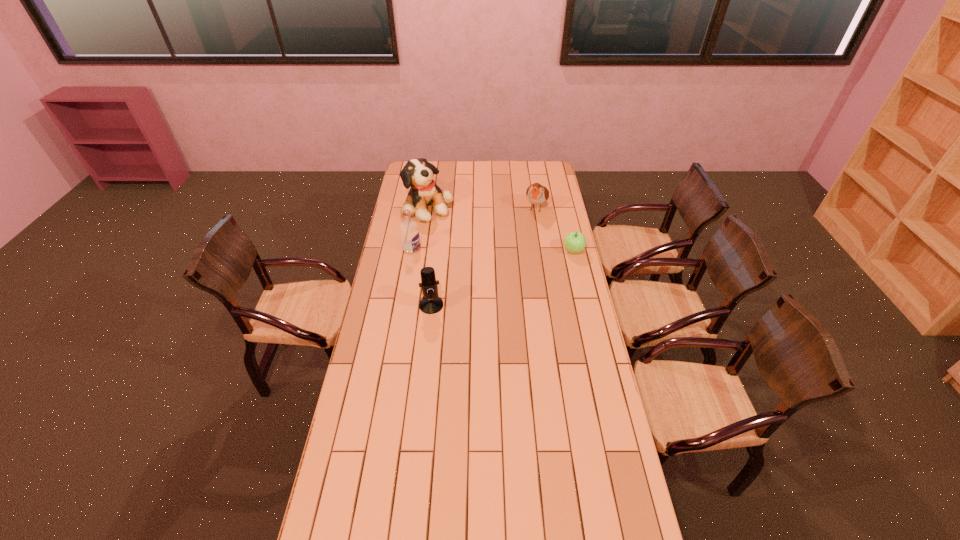
Find the location of a particular element. This screenshot has height=540, width=960. vacant space on the desktop that is between the microphone and the rightmost object and is positioned at the face of the fourth object from left to right is located at coordinates (506, 276).

You are a GUI agent. You are given a task and a screenshot of the screen. Output one action in this format:
    pyautogui.click(x=<x>, y=<y>)
    Task: Click on the free space on the desktop that is between the nearest object and the shortest object and is positioned on the label of the vodka
    The height and width of the screenshot is (540, 960).
    Given the screenshot: What is the action you would take?
    pyautogui.click(x=495, y=281)

You are a GUI agent. You are given a task and a screenshot of the screen. Output one action in this format:
    pyautogui.click(x=<x>, y=<y>)
    Task: Click on the vacant space on the desktop that is between the nearest object and the shortest object and is positioned at the face of the tallest object
    This screenshot has width=960, height=540.
    Given the screenshot: What is the action you would take?
    pyautogui.click(x=523, y=270)